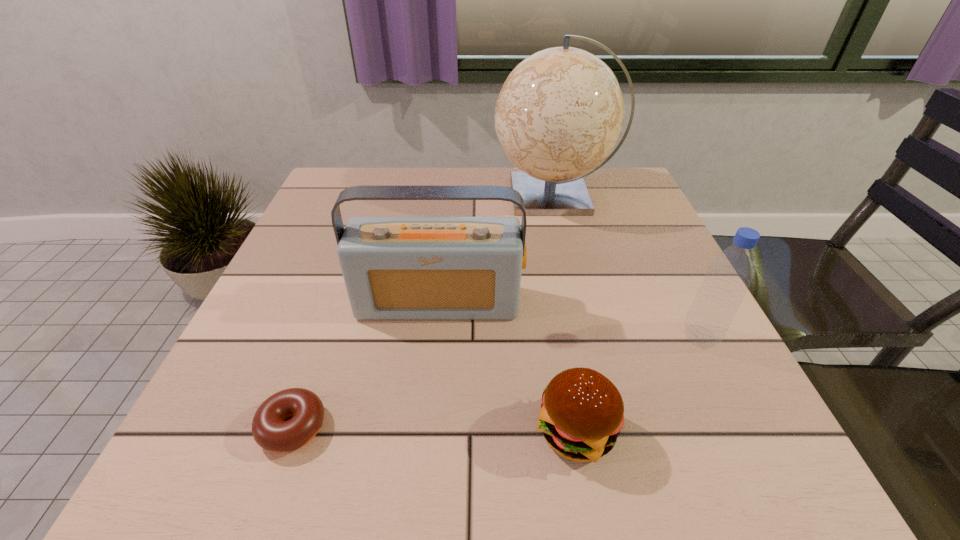
Where is `free region that satisfies the following two spatial constraints: 1. on the back side of the rightmost object; 2. on the surface of the tallest object showing Europe and Africa`? free region that satisfies the following two spatial constraints: 1. on the back side of the rightmost object; 2. on the surface of the tallest object showing Europe and Africa is located at coordinates (630, 195).

What are the coordinates of `vacant point that satisfies the following two spatial constraints: 1. on the front-facing side of the rightmost object; 2. on the left side of the radio receiver` in the screenshot? It's located at (435, 337).